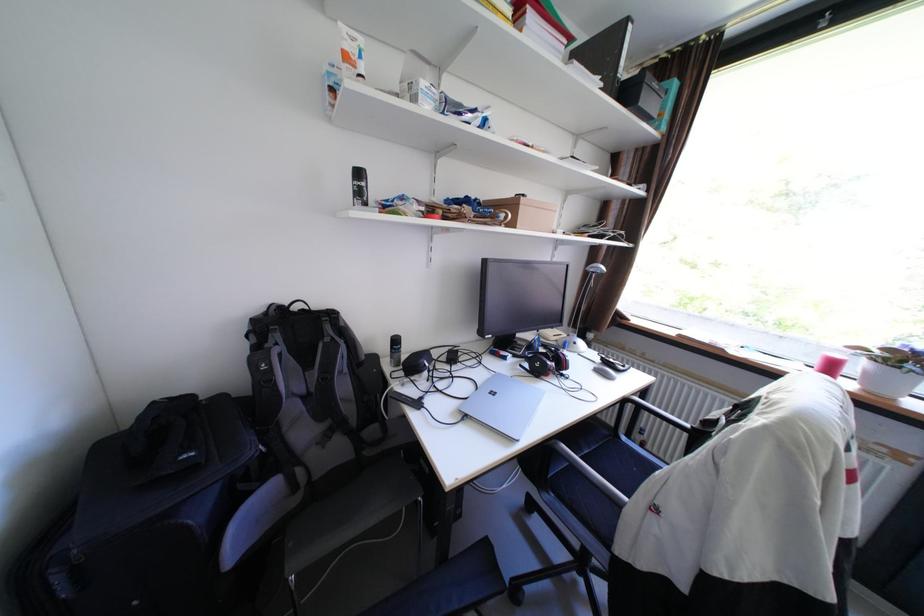
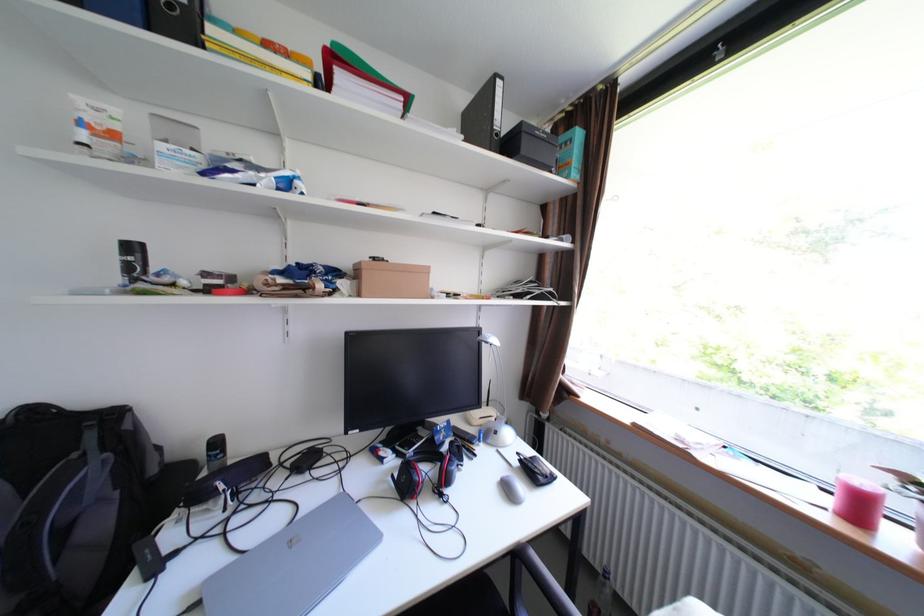
Locate, in the second image, the point that corresponds to point (476, 416) in the first image.

(208, 604)